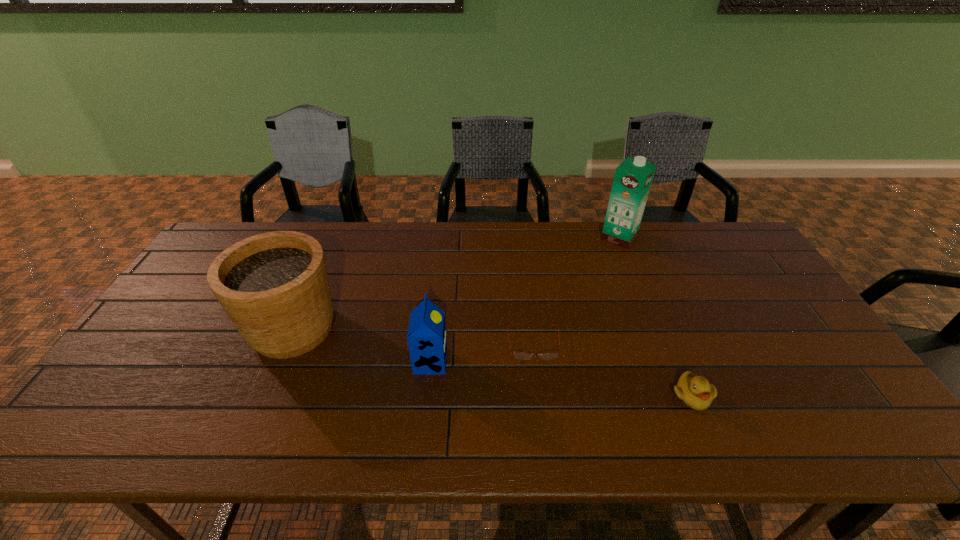
This screenshot has width=960, height=540. Identify the location of the right carton. (633, 177).

Where is `the tallest object`? the tallest object is located at coordinates (633, 177).

At what (x,y) coordinates should I click in order to perform the action: click on flowerpot. Please return your answer as a coordinate pair (x, y). The width and height of the screenshot is (960, 540). Looking at the image, I should click on (274, 286).

You are a GUI agent. You are given a task and a screenshot of the screen. Output one action in this format:
    pyautogui.click(x=<x>, y=<y>)
    Task: Click on the fourth shortest object
    
    Given the screenshot: What is the action you would take?
    pyautogui.click(x=274, y=286)

At what (x,y) coordinates should I click in order to perform the action: click on the shorter carton. Please return your answer as a coordinate pair (x, y). The image size is (960, 540). Looking at the image, I should click on (426, 336).

You are a GUI agent. You are given a task and a screenshot of the screen. Output one action in this format:
    pyautogui.click(x=<x>, y=<y>)
    Task: Click on the third tallest object
    This screenshot has width=960, height=540.
    Given the screenshot: What is the action you would take?
    pyautogui.click(x=426, y=336)

This screenshot has width=960, height=540. I want to click on the second shortest object, so click(x=696, y=392).

Image resolution: width=960 pixels, height=540 pixels. What are the coordinates of `duckling` in the screenshot? It's located at (696, 392).

What are the coordinates of `spectacles` in the screenshot? It's located at (518, 355).

In order to click on the third object from left to right in this screenshot , I will do (518, 355).